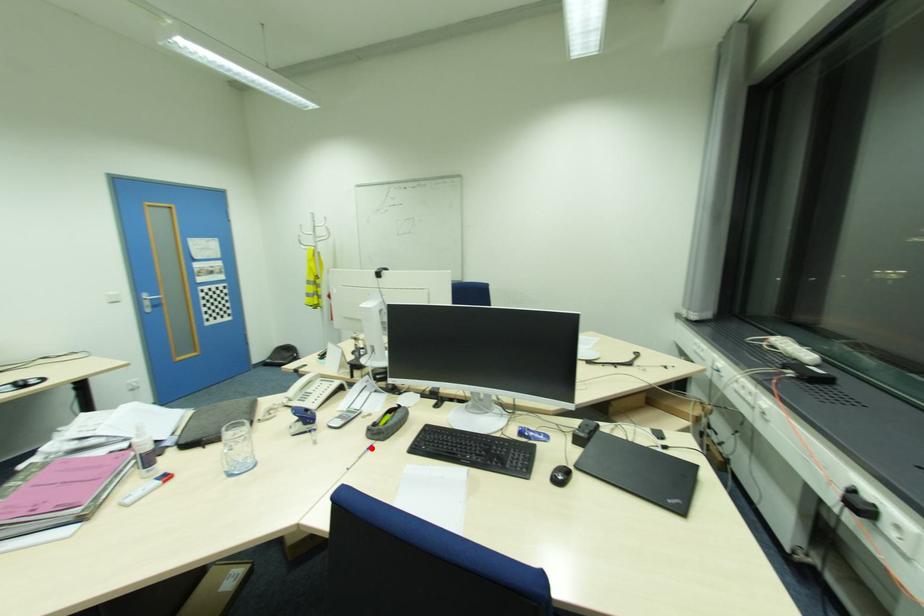
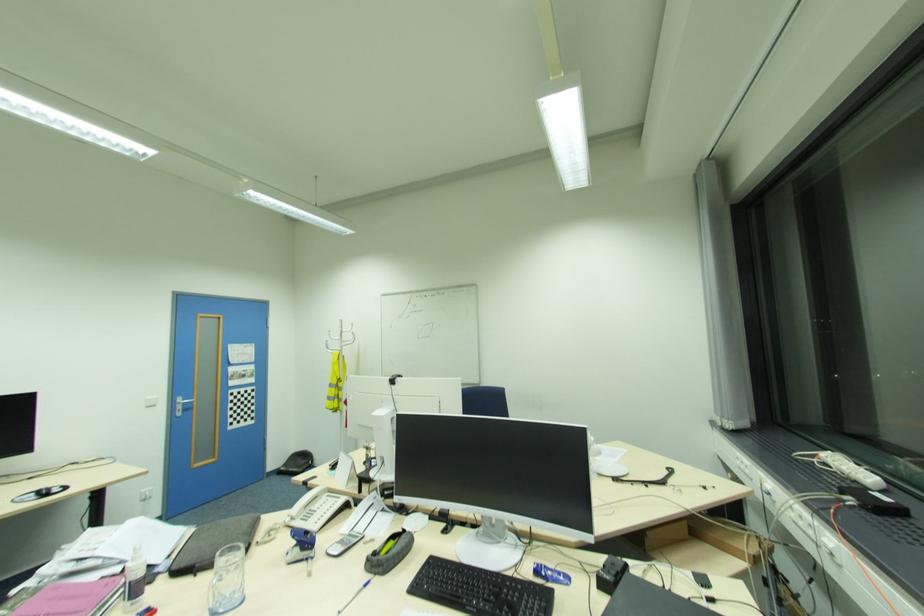
In the second image, find the point that corresponds to the highlighted location in the first image.

(369, 585)